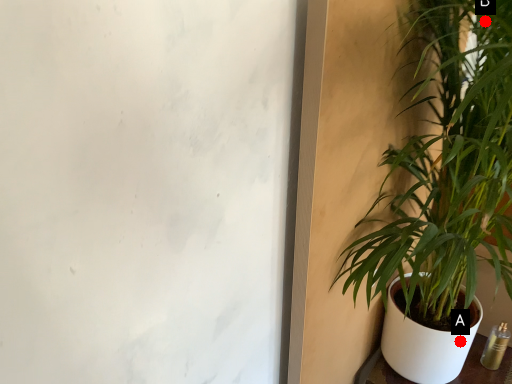
Question: Two points are circled on the image, labeled by A and B beside each circle. Which point is closer to the camera taking this photo?

Choices:
 (A) A is closer
 (B) B is closer

Answer: (B)